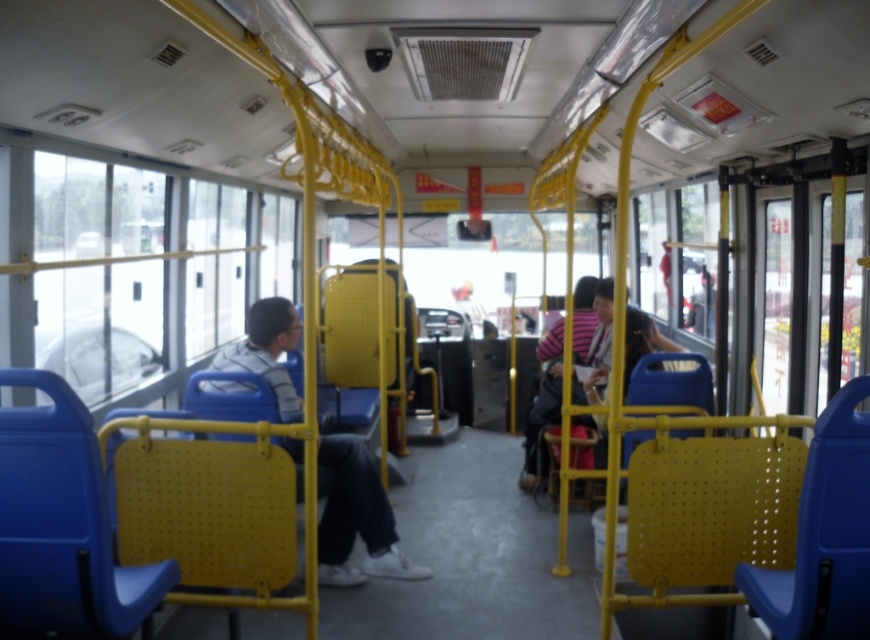
You are a passenger on a public bus and want to know which of the two points, point (343, 515) or point (606, 342), is closer to you. Based on the image, which point is nearer?

Point (343, 515) is closer to the camera than point (606, 342), so it is nearer to you.